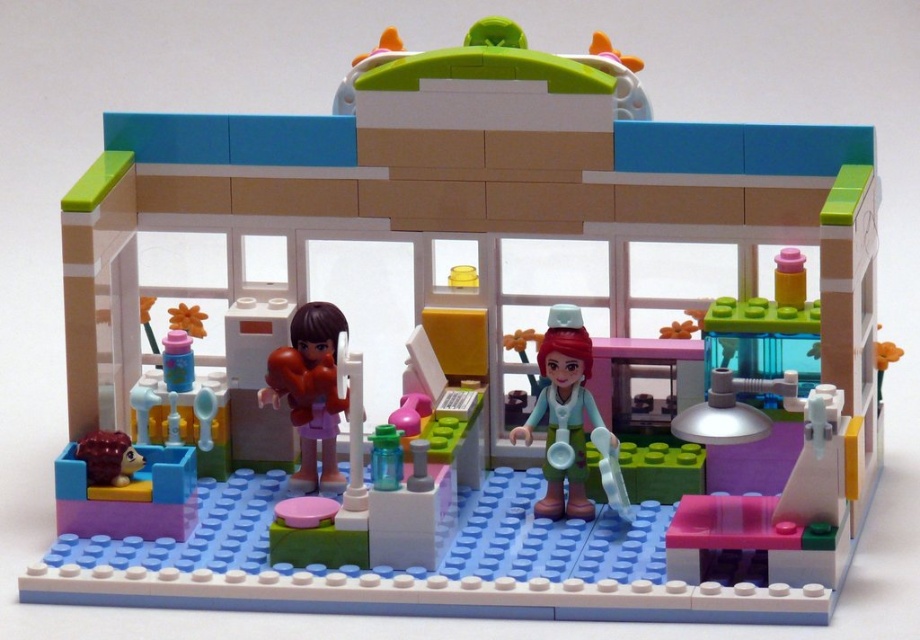
From the picture: You are a LEGO figure trying to fit through a narrow doorway in the veterinary clinic. The doorway is exactly the width of the matte brown hair at center. Can you pass through the doorway if you are wearing the smooth teal shirt at center?

The smooth teal shirt at center is wider than the matte brown hair at center. Since the doorway is the width of the matte brown hair at center, the smooth teal shirt at center would not fit through the doorway.

You are a delivery drone that needs to drop off a package at the veterinary clinic. The package must be placed exactly at the point marked by the coordinates point (548, 428). If your drone is currently positioned 1.49 meters away from the camera, can you accurately drop the package at the specified point?

The point (548, 428) is 1.49 meters away from the camera, so yes, the drone can accurately drop the package at the specified point since it is positioned at the correct distance from the camera.